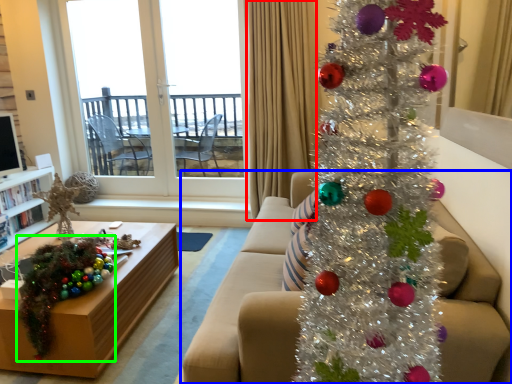
Question: Which is farther away from curtain (highlighted by a red box)? studio couch (highlighted by a blue box) or christmas decoration (highlighted by a green box)?

Choices:
 (A) studio couch
 (B) christmas decoration

Answer: (B)